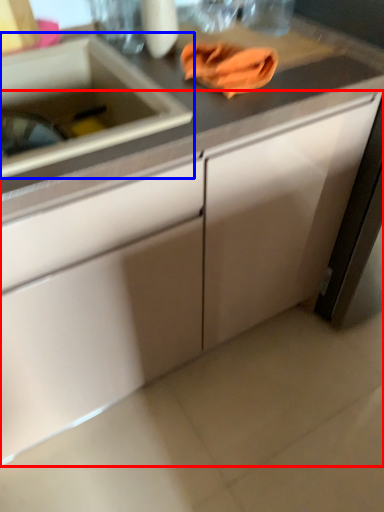
Question: Among these objects, which one is nearest to the camera, cabinetry (highlighted by a red box) or sink (highlighted by a blue box)?

Choices:
 (A) cabinetry
 (B) sink

Answer: (A)